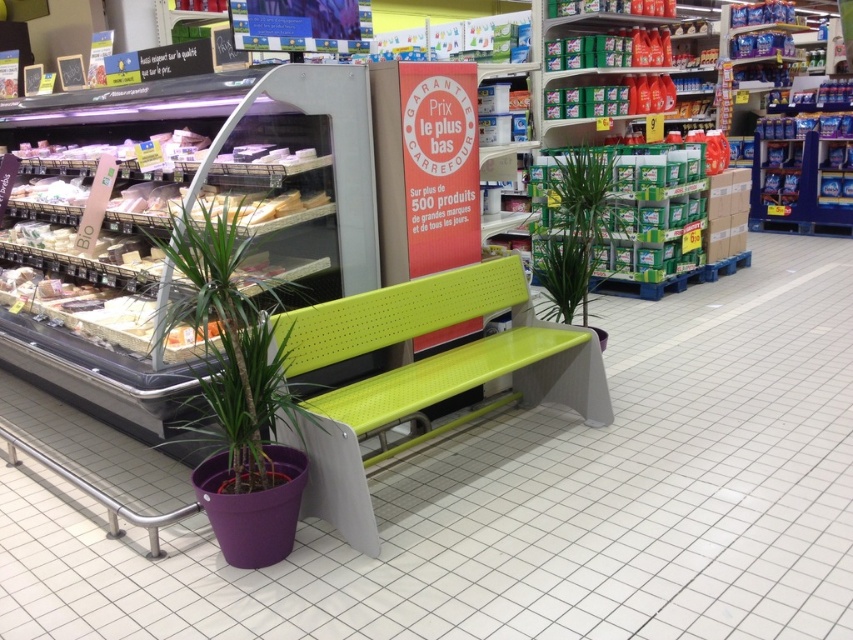
You are standing in the supermarket and want to sit down. The green plastic bench at center is at point [537,502]. Is there any other object at that point?

The point [537,502] marks the green plastic bench at center, so there is no other object at that point.